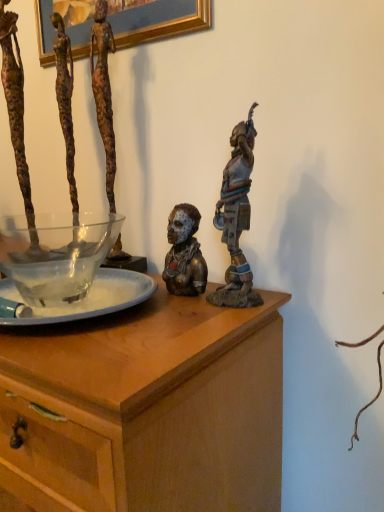
Question: From a real-world perspective, is bronze statue at center, acting as the third person starting from the left, over translucent glass bowl at center?

Choices:
 (A) no
 (B) yes

Answer: (B)

Question: Is bronze statue at center, acting as the third person starting from the left, shorter than translucent glass bowl at center?

Choices:
 (A) no
 (B) yes

Answer: (A)

Question: Is bronze statue at center, acting as the third person starting from the left, smaller than translucent glass bowl at center?

Choices:
 (A) no
 (B) yes

Answer: (B)

Question: Considering the relative positions of bronze statue at center, acting as the third person starting from the left, and translucent glass bowl at center in the image provided, is bronze statue at center, acting as the third person starting from the left, to the left of translucent glass bowl at center from the viewer's perspective?

Choices:
 (A) no
 (B) yes

Answer: (A)

Question: Is translucent glass bowl at center located within bronze statue at center, the second person positioned from the right?

Choices:
 (A) yes
 (B) no

Answer: (B)

Question: Is bronze statue at center, the second person positioned from the right, not within translucent glass bowl at center?

Choices:
 (A) no
 (B) yes

Answer: (B)

Question: From a real-world perspective, is rusty metal sculpture at left, which is the 4th person in right-to-left order, below wooden chest at center?

Choices:
 (A) no
 (B) yes

Answer: (A)

Question: Would you say wooden chest at center is part of rusty metal sculpture at left, which ranks as the first person in left-to-right order,'s contents?

Choices:
 (A) no
 (B) yes

Answer: (A)

Question: Could you tell me if rusty metal sculpture at left, which ranks as the first person in left-to-right order, is turned towards wooden chest at center?

Choices:
 (A) yes
 (B) no

Answer: (B)

Question: Does rusty metal sculpture at left, which is the 4th person in right-to-left order, appear on the right side of wooden chest at center?

Choices:
 (A) no
 (B) yes

Answer: (B)

Question: Considering the relative positions of rusty metal sculpture at left, which is the 4th person in right-to-left order, and wooden chest at center in the image provided, is rusty metal sculpture at left, which is the 4th person in right-to-left order, behind wooden chest at center?

Choices:
 (A) no
 (B) yes

Answer: (B)

Question: Can you confirm if rusty metal sculpture at left, which is the 4th person in right-to-left order, is bigger than wooden chest at center?

Choices:
 (A) yes
 (B) no

Answer: (B)

Question: Can you confirm if rusty metal sculpture at left, which is the 4th person in right-to-left order, is positioned to the right of bronze statue at upper right, acting as the 1th person starting from the right?

Choices:
 (A) no
 (B) yes

Answer: (A)